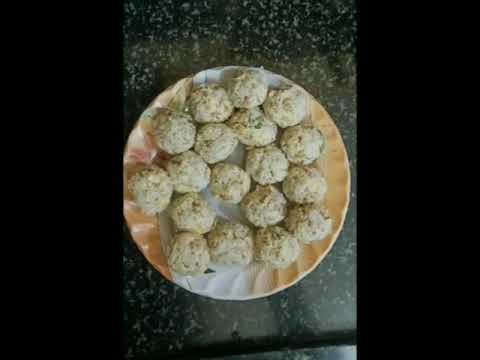
Identify the location of yellow plate. This screenshot has height=360, width=480. (341, 184).